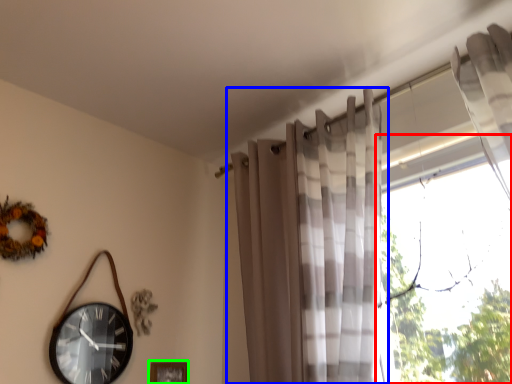
Question: Which is nearer to the window (highlighted by a red box)? curtain (highlighted by a blue box) or picture frame (highlighted by a green box).

Choices:
 (A) curtain
 (B) picture frame

Answer: (A)